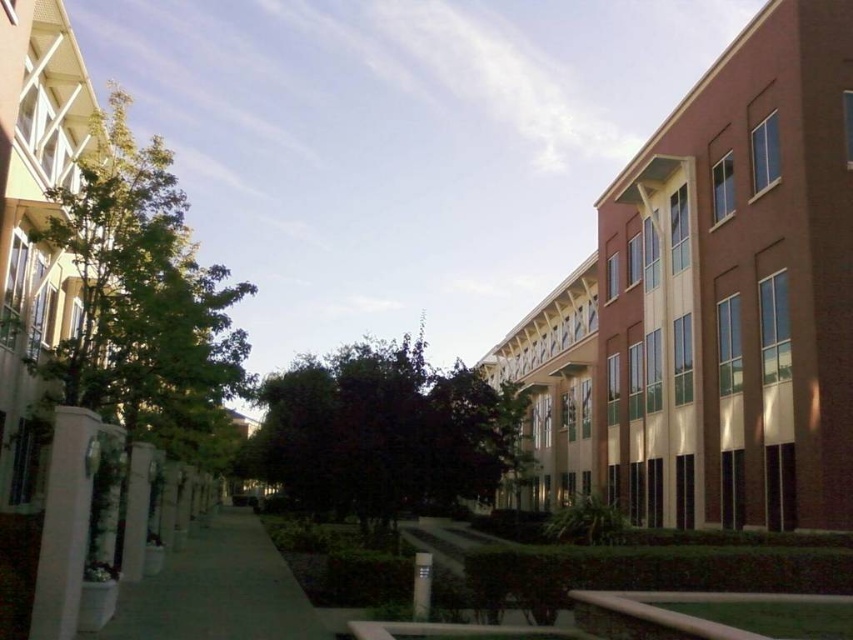
Looking at this image, can you confirm if dark green leafy tree at center is positioned above green concrete sidewalk at center?

Indeed, dark green leafy tree at center is positioned over green concrete sidewalk at center.

Does dark green leafy tree at center have a smaller size compared to green concrete sidewalk at center?

No.

Who is more forward, (318,435) or (257,605)?

Point (257,605) is in front.

Locate an element on the screen. The height and width of the screenshot is (640, 853). dark green leafy tree at center is located at coordinates (381, 433).

Is green leafy tree at left further to camera compared to dark green leafy tree at center?

No, it is not.

Between green leafy tree at left and dark green leafy tree at center, which one appears on the right side from the viewer's perspective?

From the viewer's perspective, dark green leafy tree at center appears more on the right side.

At what (x,y) coordinates should I click in order to perform the action: click on green leafy tree at left. Please return your answer as a coordinate pair (x, y). Looking at the image, I should click on (144, 301).

Which is more to the right, green leafy tree at left or green concrete sidewalk at center?

Positioned to the right is green concrete sidewalk at center.

The height and width of the screenshot is (640, 853). What do you see at coordinates (144, 301) in the screenshot? I see `green leafy tree at left` at bounding box center [144, 301].

This screenshot has width=853, height=640. Identify the location of green leafy tree at left. (144, 301).